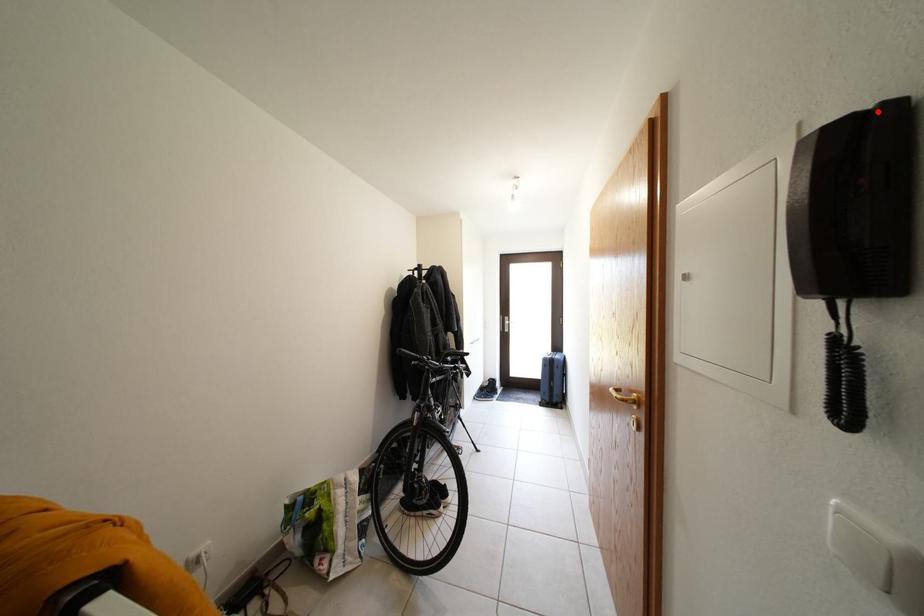
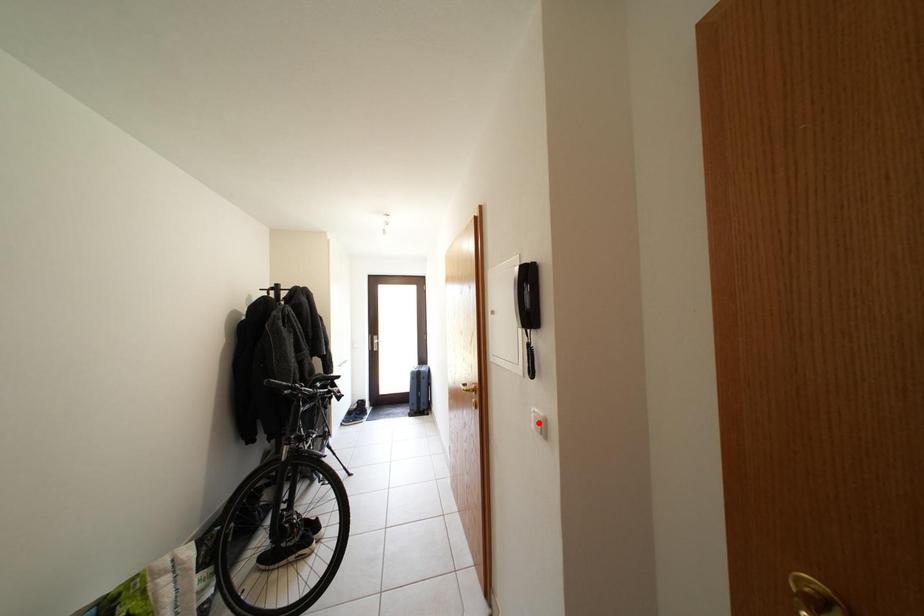
I am providing you with two images of the same scene from different viewpoints. A red point is marked on the first image and another point is marked on the second image. Is the marked point in image1 the same physical position as the marked point in image2?

No